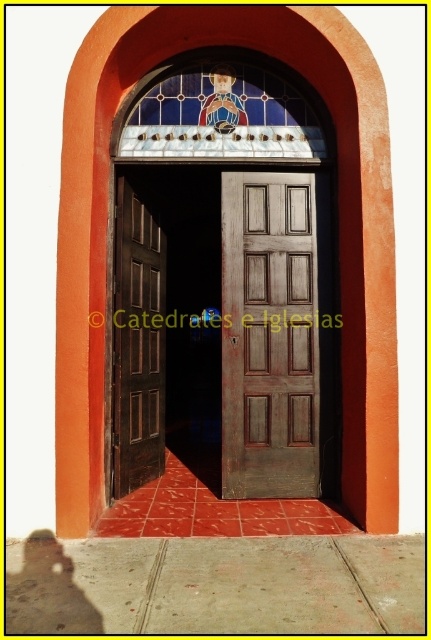
Question: Which point appears farthest from the camera in this image?

Choices:
 (A) (155, 218)
 (B) (122, 241)

Answer: (A)

Question: Which object is the closest to the wooden panel door at center?

Choices:
 (A) brown wooden door at left
 (B) wooden door at center

Answer: (A)

Question: Is wooden door at center positioned before wooden panel door at center?

Choices:
 (A) no
 (B) yes

Answer: (A)

Question: Is wooden panel door at center smaller than brown wooden door at left?

Choices:
 (A) no
 (B) yes

Answer: (B)

Question: Does wooden door at center appear under brown wooden door at left?

Choices:
 (A) yes
 (B) no

Answer: (B)

Question: Among these objects, which one is nearest to the camera?

Choices:
 (A) wooden panel door at center
 (B) brown wooden door at left

Answer: (B)